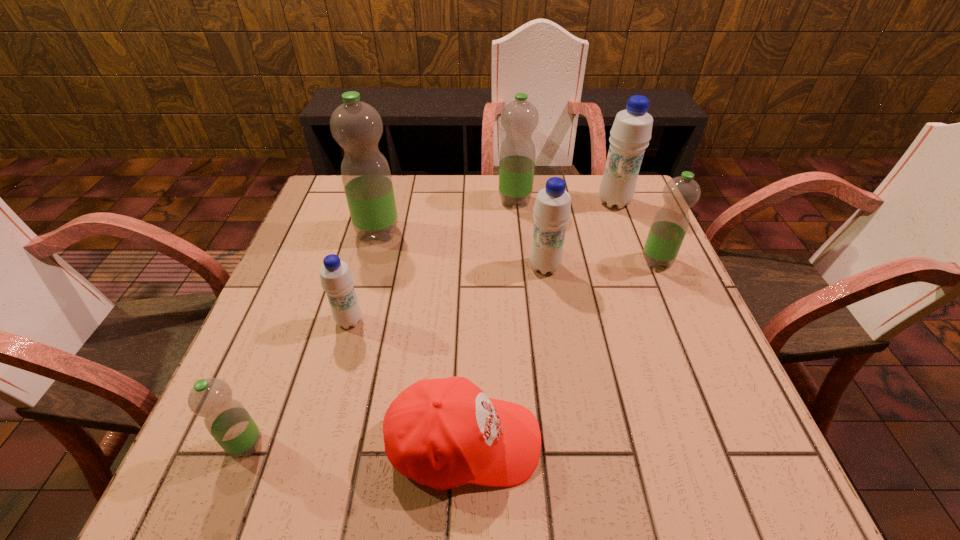
Where is `empty space between the smallest blue water bottle and the rightmost blue water bottle`? Image resolution: width=960 pixels, height=540 pixels. empty space between the smallest blue water bottle and the rightmost blue water bottle is located at coordinates (482, 261).

Locate an element on the screen. Image resolution: width=960 pixels, height=540 pixels. free space between the sixth nearest object and the nearest blue water bottle is located at coordinates (364, 276).

Choose which object is the fourth nearest neighbor to the second farthest blue water bottle. Please provide its 2D coordinates. Your answer should be formatted as a tuple, i.e. [(x, y)], where the tuple contains the x and y coordinates of a point satisfying the conditions above.

[(443, 433)]

Locate an element on the screen. The image size is (960, 540). the fifth closest object to the rightmost green water bottle is located at coordinates (356, 126).

This screenshot has height=540, width=960. Find the location of `the second closest water bottle relative to the third nearest green water bottle`. the second closest water bottle relative to the third nearest green water bottle is located at coordinates (519, 118).

In order to click on water bottle that is the fifth closest to the second nearest blue water bottle in this screenshot , I will do `click(336, 278)`.

Choose which green water bottle is the nearest neighbor to the third biggest green water bottle. Please provide its 2D coordinates. Your answer should be formatted as a tuple, i.e. [(x, y)], where the tuple contains the x and y coordinates of a point satisfying the conditions above.

[(519, 118)]

Locate which green water bottle is the third closest to the rightmost green water bottle. Please provide its 2D coordinates. Your answer should be formatted as a tuple, i.e. [(x, y)], where the tuple contains the x and y coordinates of a point satisfying the conditions above.

[(226, 419)]

Select which blue water bottle appears as the third closest to the baseball cap. Please provide its 2D coordinates. Your answer should be formatted as a tuple, i.e. [(x, y)], where the tuple contains the x and y coordinates of a point satisfying the conditions above.

[(631, 132)]

At what (x,y) coordinates should I click in order to perform the action: click on blue water bottle that stands as the third closest to the rightmost green water bottle. Please return your answer as a coordinate pair (x, y). The image size is (960, 540). Looking at the image, I should click on (336, 278).